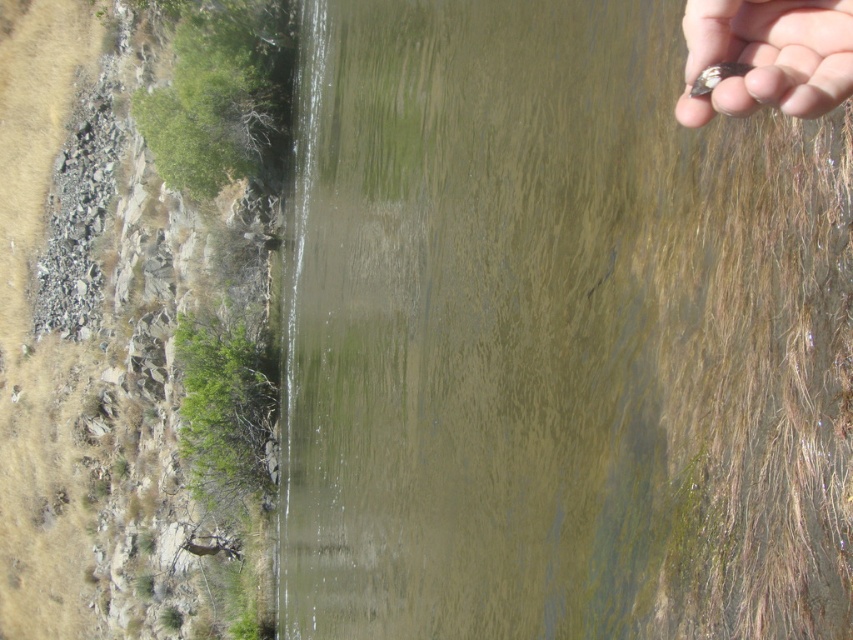
You are standing on the rocky shoreline at left and want to cross to the opposite side of the greenish murky water at upper center. Can you step onto the rocks at left to reach the other side?

The greenish murky water at upper center is above rocks at left, meaning the rocks are on the shoreline and the water is in front of them. To cross to the opposite side, you would need to wade through the water since the rocks are part of the shoreline you are already on.